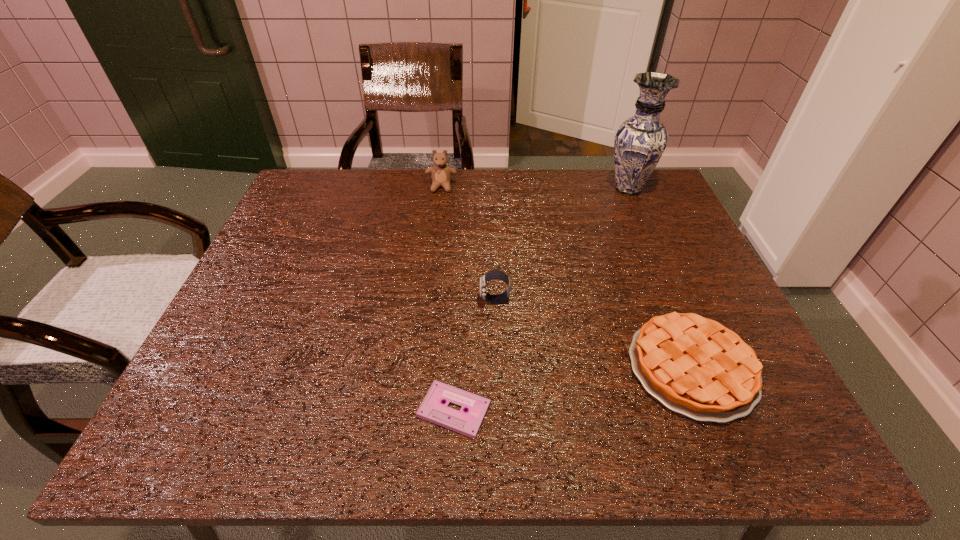
Locate an element on the screen. This screenshot has width=960, height=540. vacant space located 0.080m on the face of the watch is located at coordinates (444, 300).

This screenshot has height=540, width=960. What are the coordinates of `vacant space located on the back of the fourth tallest object` in the screenshot? It's located at (630, 217).

This screenshot has width=960, height=540. What are the coordinates of `free spot located 0.260m on the right of the videotape` in the screenshot? It's located at pos(633,410).

Where is `vase at the far edge`? The image size is (960, 540). vase at the far edge is located at coordinates (640, 141).

At what (x,y) coordinates should I click in order to perform the action: click on teddy bear at the far edge. Please return your answer as a coordinate pair (x, y). This screenshot has width=960, height=540. Looking at the image, I should click on (440, 173).

The image size is (960, 540). In order to click on pie located in the near edge section of the desktop in this screenshot , I will do `click(695, 366)`.

Where is `videotape that is at the near edge`? videotape that is at the near edge is located at coordinates (432, 408).

You are a GUI agent. You are given a task and a screenshot of the screen. Output one action in this format:
    pyautogui.click(x=<x>, y=<y>)
    Task: Click on the vase located at the right edge
    The height and width of the screenshot is (540, 960).
    Given the screenshot: What is the action you would take?
    pyautogui.click(x=640, y=141)

Where is `pie that is at the right edge`? Image resolution: width=960 pixels, height=540 pixels. pie that is at the right edge is located at coordinates (695, 366).

Image resolution: width=960 pixels, height=540 pixels. In order to click on object located in the far right corner section of the desktop in this screenshot , I will do `click(640, 141)`.